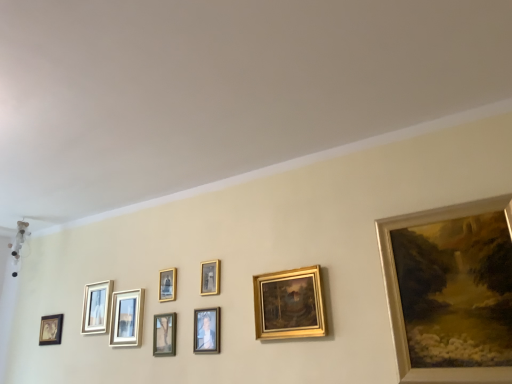
Question: Can you confirm if gold metallic photo frame at center, placed as the seventh picture frame when sorted from left to right, is taller than matte white picture frame at center, which appears as the third picture frame when viewed from the left?

Choices:
 (A) no
 (B) yes

Answer: (A)

Question: Does gold metallic photo frame at center, the 3th picture frame from the right, have a greater width compared to matte white picture frame at center, which is the seventh picture frame from right to left?

Choices:
 (A) no
 (B) yes

Answer: (A)

Question: Does gold metallic photo frame at center, placed as the seventh picture frame when sorted from left to right, have a lesser width compared to matte white picture frame at center, which appears as the third picture frame when viewed from the left?

Choices:
 (A) yes
 (B) no

Answer: (A)

Question: Is gold metallic photo frame at center, the 3th picture frame from the right, not inside matte white picture frame at center, which is the seventh picture frame from right to left?

Choices:
 (A) no
 (B) yes

Answer: (B)

Question: Is gold metallic photo frame at center, placed as the seventh picture frame when sorted from left to right, far away from matte white picture frame at center, which is the seventh picture frame from right to left?

Choices:
 (A) no
 (B) yes

Answer: (A)

Question: From a real-world perspective, is gold metallic photo frame at center, the 3th picture frame from the right, positioned under matte white picture frame at center, which appears as the third picture frame when viewed from the left, based on gravity?

Choices:
 (A) no
 (B) yes

Answer: (A)

Question: Is matte gold picture frame at upper left, which appears as the eighth picture frame when viewed from the right, shorter than gold metallic photo frame at center, placed as the seventh picture frame when sorted from left to right?

Choices:
 (A) no
 (B) yes

Answer: (A)

Question: Is matte gold picture frame at upper left, which appears as the eighth picture frame when viewed from the right, turned away from gold metallic photo frame at center, the 3th picture frame from the right?

Choices:
 (A) yes
 (B) no

Answer: (B)

Question: Can you confirm if matte gold picture frame at upper left, which appears as the eighth picture frame when viewed from the right, is positioned to the left of gold metallic photo frame at center, the 3th picture frame from the right?

Choices:
 (A) no
 (B) yes

Answer: (B)

Question: Does matte gold picture frame at upper left, acting as the second picture frame starting from the left, appear on the right side of gold metallic photo frame at center, placed as the seventh picture frame when sorted from left to right?

Choices:
 (A) no
 (B) yes

Answer: (A)

Question: Is matte gold picture frame at upper left, acting as the second picture frame starting from the left, next to gold metallic photo frame at center, placed as the seventh picture frame when sorted from left to right, and touching it?

Choices:
 (A) no
 (B) yes

Answer: (A)

Question: Is matte gold picture frame at upper left, which appears as the eighth picture frame when viewed from the right, not inside gold metallic photo frame at center, placed as the seventh picture frame when sorted from left to right?

Choices:
 (A) no
 (B) yes

Answer: (B)

Question: From a real-world perspective, is matte gold picture frame at center, the 6th picture frame viewed from the left, on matte black picture frame at lower left, marked as the 9th picture frame in a right-to-left arrangement?

Choices:
 (A) no
 (B) yes

Answer: (A)